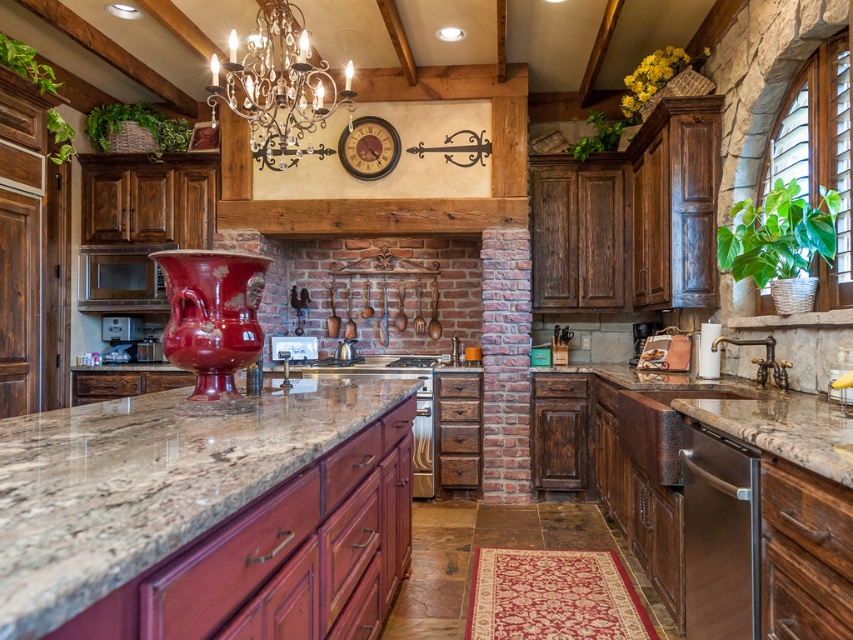
Question: Which point is farther from the camera taking this photo?

Choices:
 (A) (735, 467)
 (B) (221, 90)

Answer: (B)

Question: Among these points, which one is nearest to the camera?

Choices:
 (A) (126, 532)
 (B) (309, 115)
 (C) (714, 582)

Answer: (A)

Question: Which point is farther to the camera?

Choices:
 (A) satin stainless steel dishwasher at lower right
 (B) silver metallic chandelier at upper center
 (C) brown granite countertop at center

Answer: (B)

Question: Can you confirm if satin stainless steel dishwasher at lower right is thinner than silver metallic chandelier at upper center?

Choices:
 (A) no
 (B) yes

Answer: (B)

Question: Can you confirm if brown granite countertop at center is positioned to the left of silver metallic chandelier at upper center?

Choices:
 (A) yes
 (B) no

Answer: (B)

Question: Considering the relative positions of satin stainless steel dishwasher at lower right and silver metallic chandelier at upper center in the image provided, where is satin stainless steel dishwasher at lower right located with respect to silver metallic chandelier at upper center?

Choices:
 (A) below
 (B) above

Answer: (A)